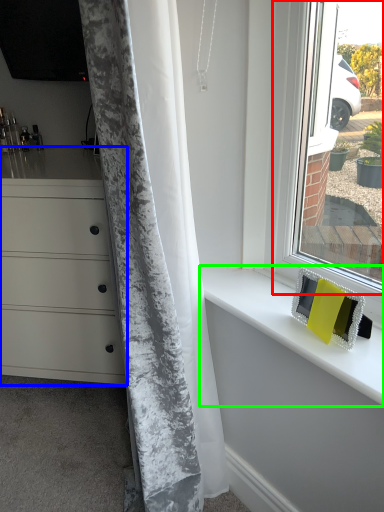
Question: Which object is positioned farthest from window (highlighted by a red box)? Select from chest of drawers (highlighted by a blue box) and counter top (highlighted by a green box).

Choices:
 (A) chest of drawers
 (B) counter top

Answer: (A)